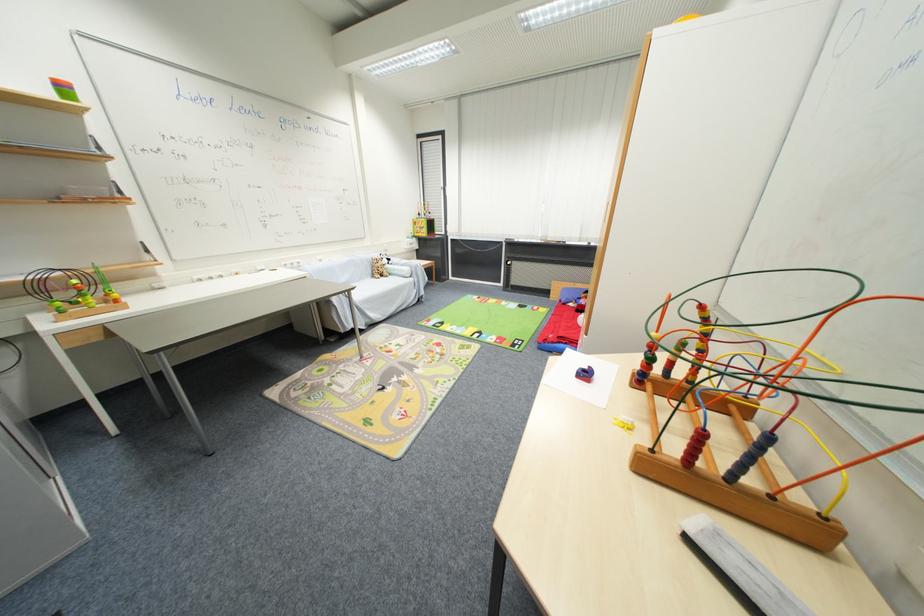
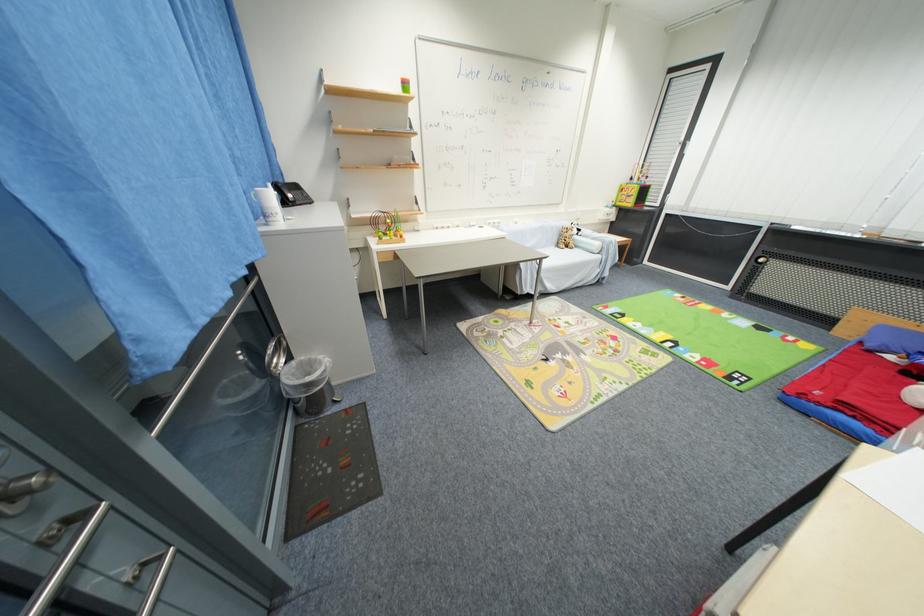
Locate, in the second image, the point that corresponds to pixel 379 277 in the first image.

(563, 246)